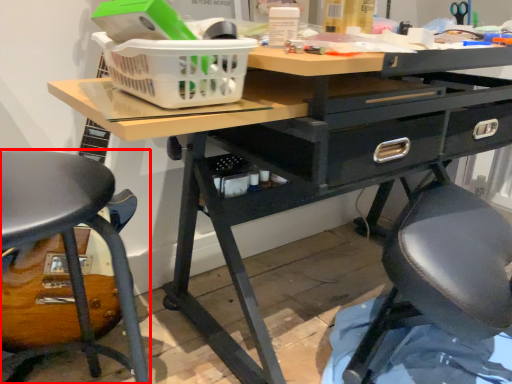
Question: Where is chair (annotated by the red box) located in relation to basket in the image?

Choices:
 (A) right
 (B) left

Answer: (B)